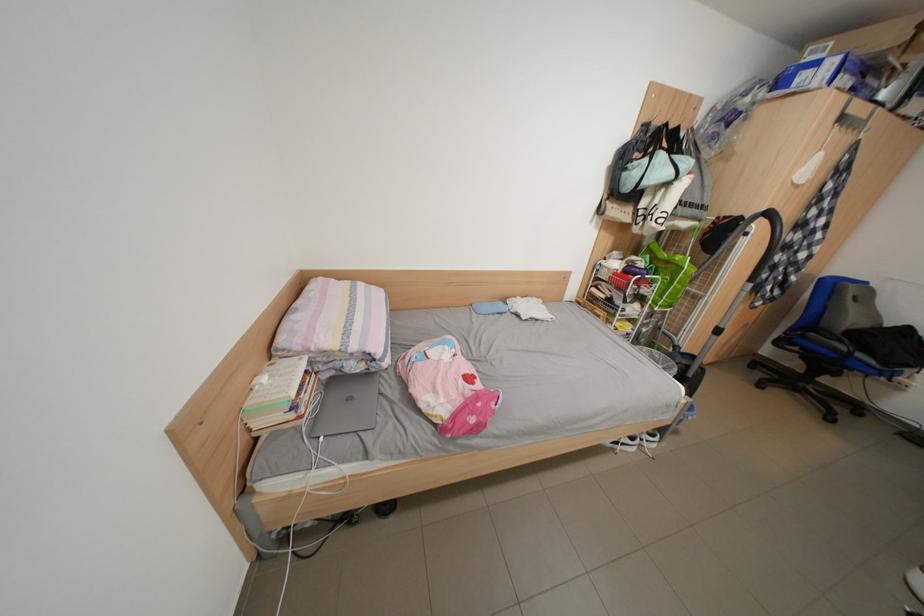
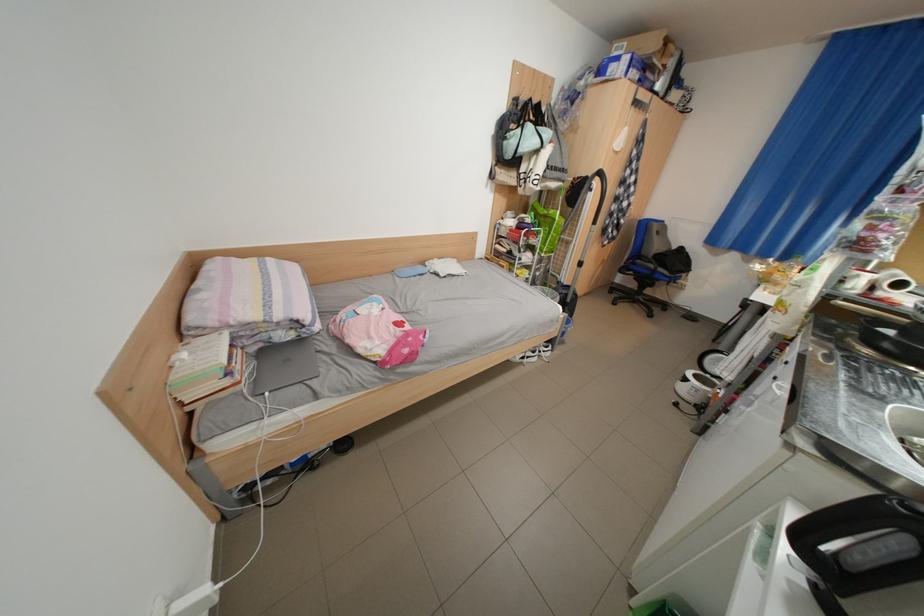
Question: The first image is from the beginning of the video and the second image is from the end. How did the camera likely rotate when shooting the video?

Choices:
 (A) Left
 (B) Right
 (C) Up
 (D) Down

Answer: (B)